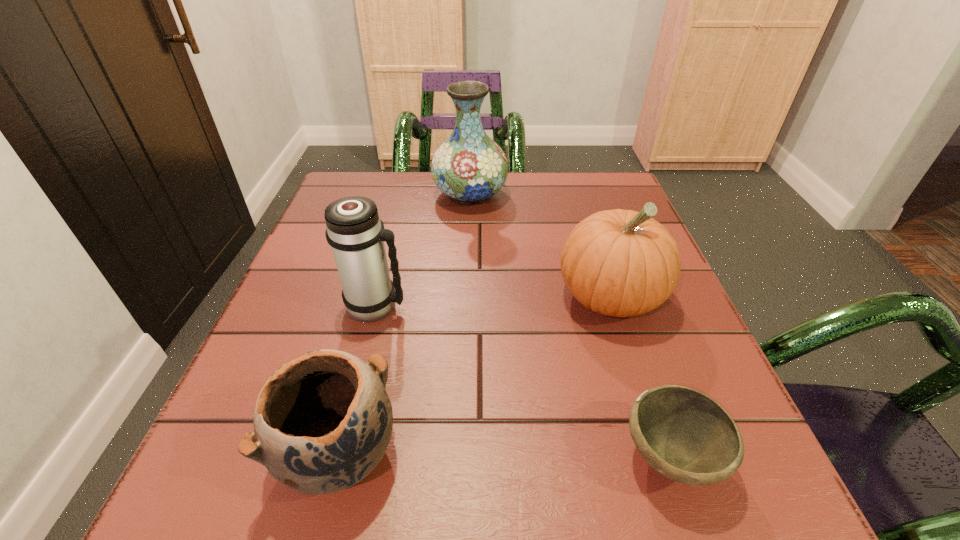
Locate an element on the screen. The width and height of the screenshot is (960, 540). vase is located at coordinates (469, 167).

Identify the location of the farthest object. (469, 167).

Where is `thermos bottle`? This screenshot has height=540, width=960. thermos bottle is located at coordinates (354, 230).

Locate an element on the screen. The width and height of the screenshot is (960, 540). pumpkin is located at coordinates (621, 263).

Locate an element on the screen. The image size is (960, 540). pottery is located at coordinates (322, 422).

Locate an element on the screen. The width and height of the screenshot is (960, 540). bowl is located at coordinates (686, 436).

Identify the location of free space located on the right of the farthest object. This screenshot has height=540, width=960. (550, 194).

Identify the location of free space located 0.330m on the side with the handle of the thermos bottle. Image resolution: width=960 pixels, height=540 pixels. (582, 305).

Where is `free space located 0.100m on the stem of the pumpkin`? The width and height of the screenshot is (960, 540). free space located 0.100m on the stem of the pumpkin is located at coordinates (638, 386).

Where is `vacant point located 0.270m on the right of the fourth tallest object`? This screenshot has width=960, height=540. vacant point located 0.270m on the right of the fourth tallest object is located at coordinates (594, 453).